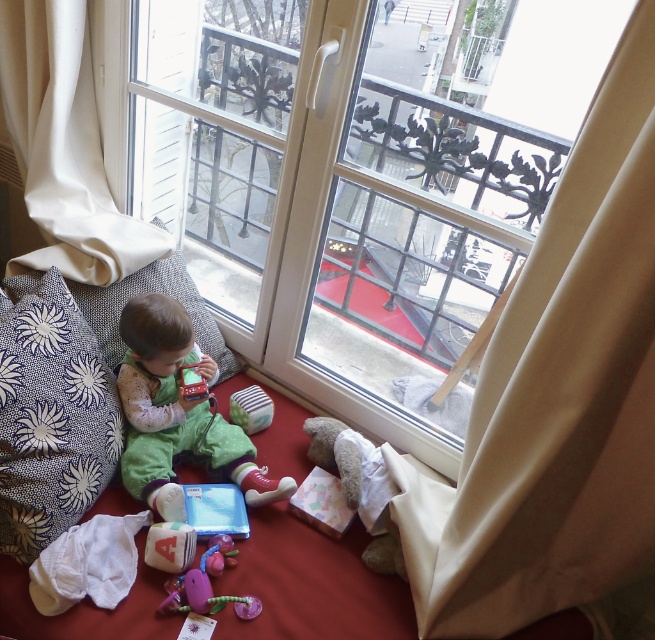
Between transparent glass window at center and blue floral fabric pillow at left, which one has less height?

blue floral fabric pillow at left

Who is more forward, (426, 284) or (121, 282)?

Positioned in front is point (121, 282).

Locate an element on the screen. The width and height of the screenshot is (655, 640). transparent glass window at center is located at coordinates (367, 180).

Who is more forward, (x=37, y=115) or (x=179, y=580)?

Point (x=179, y=580) is more forward.

Between white fabric curtain at upper left and purple rubber teething toy at center, which one has less height?

With less height is purple rubber teething toy at center.

Does point (140, 225) come in front of point (252, 598)?

No, it is behind (252, 598).

At what (x,y) coordinates should I click in order to perform the action: click on white fabric curtain at upper left. Please return your answer as a coordinate pair (x, y). This screenshot has height=640, width=655. Looking at the image, I should click on (64, 147).

Is transparent glass window at center further to the viewer compared to beige fabric curtain at right?

Yes.

In the scene shown: Is transparent glass window at center closer to the viewer compared to beige fabric curtain at right?

No, transparent glass window at center is further to the viewer.

The height and width of the screenshot is (640, 655). In order to click on transparent glass window at center in this screenshot , I will do `click(367, 180)`.